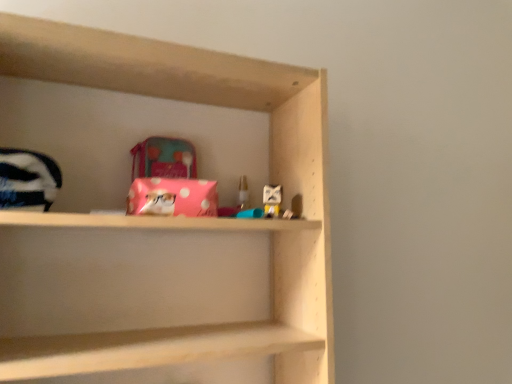
Question: From a real-world perspective, relative to pink polka dot fabric at center, is pink polka dot plush at upper center, the second toy positioned from the left, vertically above or below?

Choices:
 (A) above
 (B) below

Answer: (B)

Question: Considering the positions of pink polka dot plush at upper center, the 2th toy when ordered from back to front, and pink polka dot fabric at center in the image, is pink polka dot plush at upper center, the 2th toy when ordered from back to front, taller or shorter than pink polka dot fabric at center?

Choices:
 (A) tall
 (B) short

Answer: (B)

Question: Based on their relative distances, which object is nearer to the pink polka dot plush at upper center, the first toy viewed from the right?

Choices:
 (A) pink polka dot fabric at center
 (B) translucent plastic candle at center, which ranks as the 2th toy in front-to-back order

Answer: (B)

Question: Estimate the real-world distances between objects in this image. Which object is closer to the pink polka dot fabric at center?

Choices:
 (A) pink polka dot plush at upper center, the first toy viewed from the right
 (B) translucent plastic candle at center, which appears as the first toy when viewed from the left

Answer: (A)